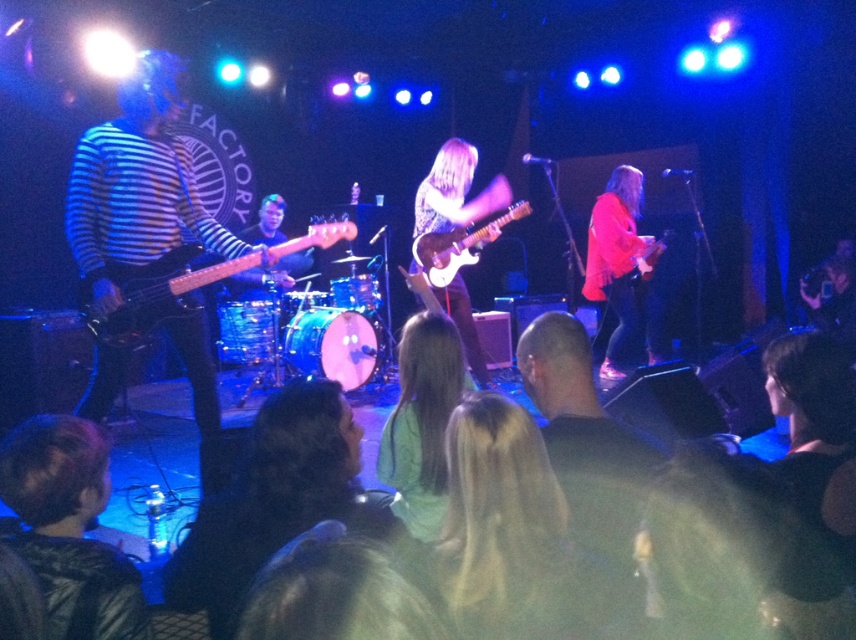
Question: Considering the real-world distances, which object is closest to the white glossy electric guitar at center?

Choices:
 (A) light green fabric shirt at center
 (B) matte black electric guitar at left
 (C) matte pink sweater at right

Answer: (B)

Question: Among these objects, which one is nearest to the camera?

Choices:
 (A) matte pink sweater at right
 (B) dark brown leather jacket at lower left
 (C) white glossy electric guitar at center
 (D) matte black electric guitar at left

Answer: (B)

Question: Which of the following is the closest to the observer?

Choices:
 (A) matte black electric guitar at center
 (B) white glossy electric guitar at center
 (C) matte black electric guitar at left
 (D) matte pink sweater at right

Answer: (C)

Question: Is light green fabric shirt at center to the right of matte black electric guitar at left from the viewer's perspective?

Choices:
 (A) yes
 (B) no

Answer: (A)

Question: Is dark brown leather jacket at lower left thinner than matte black electric guitar at center?

Choices:
 (A) yes
 (B) no

Answer: (A)

Question: Does dark brown leather jacket at lower left appear under matte pink sweater at right?

Choices:
 (A) no
 (B) yes

Answer: (B)